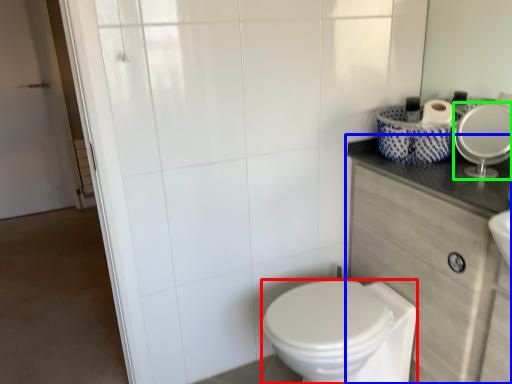
Question: Which object is the farthest from bidet (highlighted by a red box)? Choose among these: counter top (highlighted by a blue box) or mirror (highlighted by a green box).

Choices:
 (A) counter top
 (B) mirror

Answer: (B)